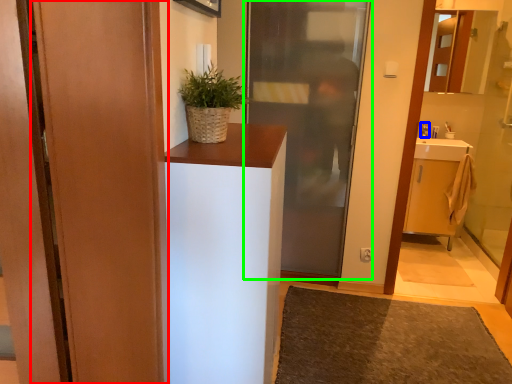
Question: Estimate the real-world distances between objects in this image. Which object is farther from door (highlighted by a red box), toiletry (highlighted by a blue box) or door (highlighted by a green box)?

Choices:
 (A) toiletry
 (B) door

Answer: (A)